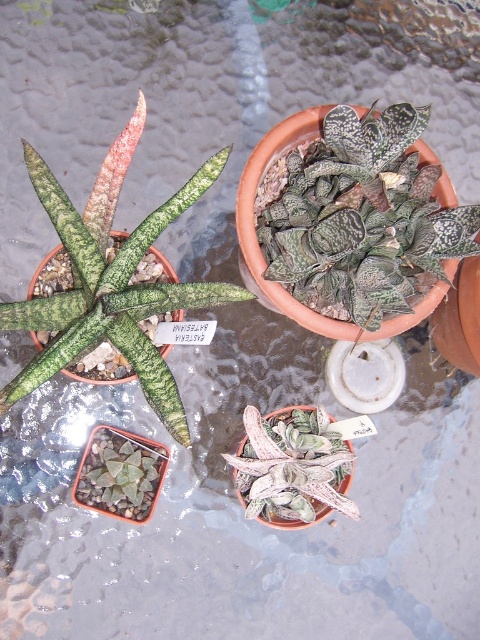
In the scene shown: You are a gardener looking at the image of potted plants on a wet, textured surface. You need to water the white textured leaf at center and the green textured succulent at lower left. Which plant should you water first if you start from the bottom of the image?

The green textured succulent at lower left should be watered first because it is located at the lower left, which is closer to the bottom of the image compared to the white textured leaf at center that is positioned above it.

Looking at the arrangement of plants on the wet, pebbled surface, where is the textured terracotta pot at upper center positioned relative to the white textured leaf at center?

The textured terracotta pot at upper center is to the right of the white textured leaf at center.

You are trying to place a small decorative stone between the textured terracotta pot at upper center and the white textured leaf at center. Based on their sizes, which object should you place the stone next to to ensure it fits comfortably?

The textured terracotta pot at upper center might be wider than the white textured leaf at center, so placing the stone next to the pot would provide more space for it to fit comfortably.